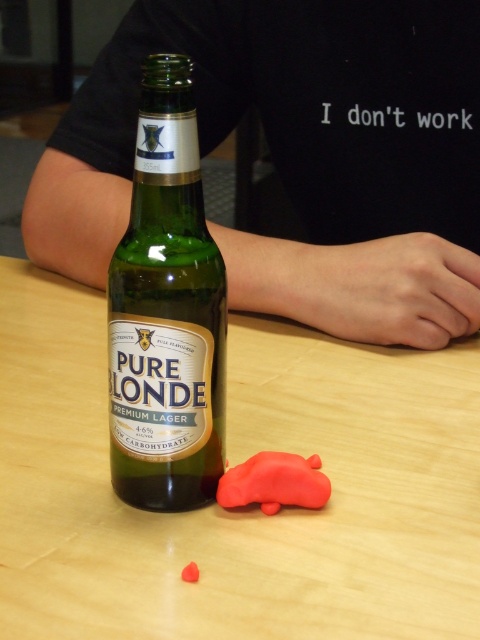
You are standing in front of the wooden table at center and want to place a small item on the rubber car at lower center. Can you reach it without moving your position?

The wooden table at center is closer to the viewer than the rubber car at lower center, so you can reach the rubber car at lower center by extending your arm over the table.

You are standing in front of a table with a green glass bottle and a small red car. There is a point marked at coordinates (300, 156). What object is located at that point?

The point at coordinates (300, 156) corresponds to the black cotton shirt at upper center.